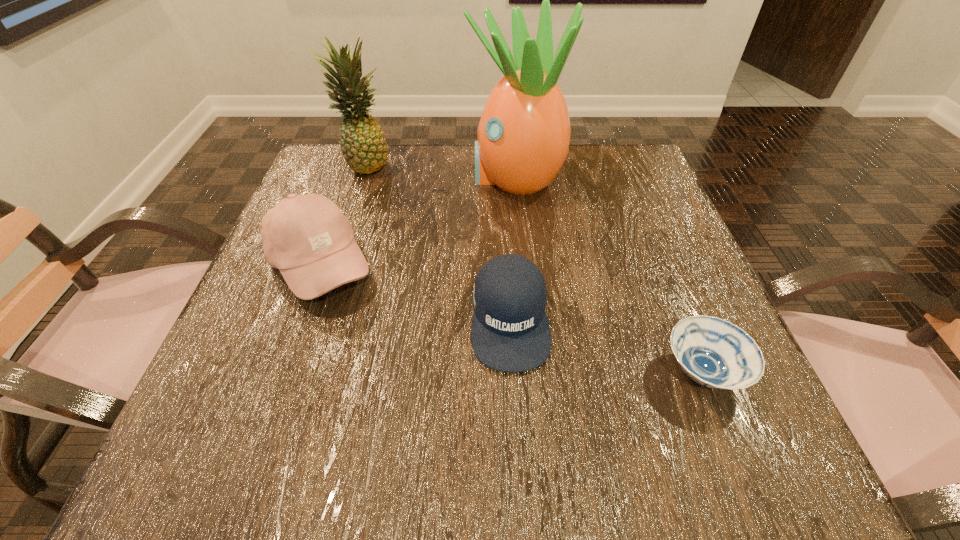
I want to click on empty space between the taller pineapple and the third shortest object, so click(418, 221).

Find the location of a particular element. empty location between the shorter baseball cap and the tallest object is located at coordinates (513, 247).

What are the coordinates of `free space between the third tallest object and the taller pineapple` in the screenshot? It's located at (418, 221).

The width and height of the screenshot is (960, 540). In order to click on object that is the fourth closest to the shorter baseball cap in this screenshot , I will do `click(362, 141)`.

Locate which object is the closest to the shorter pineapple. Please provide its 2D coordinates. Your answer should be formatted as a tuple, i.e. [(x, y)], where the tuple contains the x and y coordinates of a point satisfying the conditions above.

[(307, 237)]

At what (x,y) coordinates should I click in order to perform the action: click on free spot that satisfies the following two spatial constraints: 1. on the front-facing side of the rightmost object; 2. on the right side of the taller baseball cap. Please return your answer as a coordinate pair (x, y). This screenshot has width=960, height=540. Looking at the image, I should click on (282, 372).

The image size is (960, 540). Identify the location of free region that satisfies the following two spatial constraints: 1. on the front-facing side of the left baseball cap; 2. on the right side of the soup bowl. (282, 372).

Where is `blank space that satisfies the following two spatial constraints: 1. at the entrance of the tallest object; 2. on the front-facing side of the right baseball cap`? The width and height of the screenshot is (960, 540). blank space that satisfies the following two spatial constraints: 1. at the entrance of the tallest object; 2. on the front-facing side of the right baseball cap is located at coordinates (529, 318).

At what (x,y) coordinates should I click in order to perform the action: click on free space that satisfies the following two spatial constraints: 1. on the front-facing side of the third shortest object; 2. on the right side of the soup bowl. Please return your answer as a coordinate pair (x, y). Looking at the image, I should click on click(x=282, y=372).